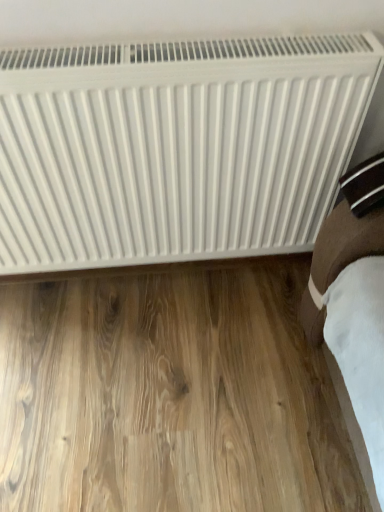
Question: From the image's perspective, relative to white matte radiator at upper center, is light brown wood flooring at lower center above or below?

Choices:
 (A) above
 (B) below

Answer: (B)

Question: Considering the positions of light brown wood flooring at lower center and white matte radiator at upper center in the image, is light brown wood flooring at lower center taller or shorter than white matte radiator at upper center?

Choices:
 (A) short
 (B) tall

Answer: (A)

Question: Is light brown wood flooring at lower center inside or outside of white matte radiator at upper center?

Choices:
 (A) inside
 (B) outside

Answer: (B)

Question: Is white matte radiator at upper center in front of or behind light brown wood flooring at lower center in the image?

Choices:
 (A) front
 (B) behind

Answer: (A)

Question: Is point pos(147,260) closer or farther from the camera than point pos(294,302)?

Choices:
 (A) closer
 (B) farther

Answer: (A)

Question: Is white matte radiator at upper center inside the boundaries of light brown wood flooring at lower center, or outside?

Choices:
 (A) outside
 (B) inside

Answer: (A)

Question: In terms of width, does white matte radiator at upper center look wider or thinner when compared to light brown wood flooring at lower center?

Choices:
 (A) thin
 (B) wide

Answer: (A)